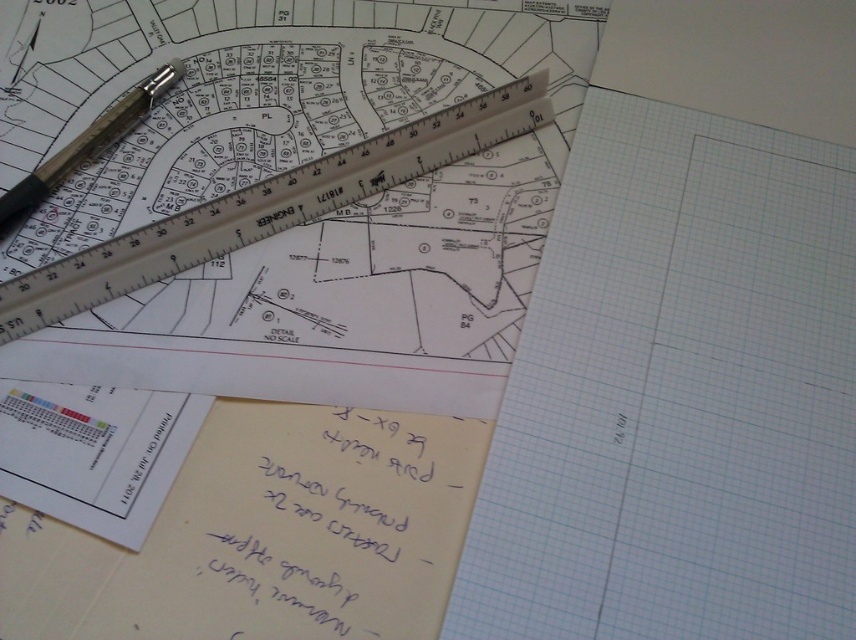
Question: Which object is farther from the camera taking this photo?

Choices:
 (A) metallic silver pen at upper left
 (B) white grid paper at center

Answer: (A)

Question: Does white grid paper at center lie behind metallic silver pen at upper left?

Choices:
 (A) no
 (B) yes

Answer: (A)

Question: Which point appears closest to the camera in this image?

Choices:
 (A) (626, 486)
 (B) (6, 204)

Answer: (A)

Question: Can you confirm if white grid paper at center is wider than metallic silver pen at upper left?

Choices:
 (A) no
 (B) yes

Answer: (B)

Question: Considering the relative positions of white grid paper at center and metallic silver ruler at upper center in the image provided, where is white grid paper at center located with respect to metallic silver ruler at upper center?

Choices:
 (A) left
 (B) right

Answer: (B)

Question: Which point is farther to the camera?

Choices:
 (A) metallic silver pen at upper left
 (B) metallic silver ruler at upper center
 (C) white grid paper at center

Answer: (A)